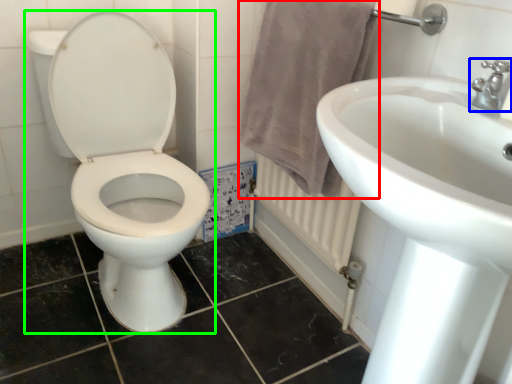
Question: Which object is the farthest from bath towel (highlighted by a red box)? Choose among these: tap (highlighted by a blue box) or toilet (highlighted by a green box).

Choices:
 (A) tap
 (B) toilet

Answer: (A)